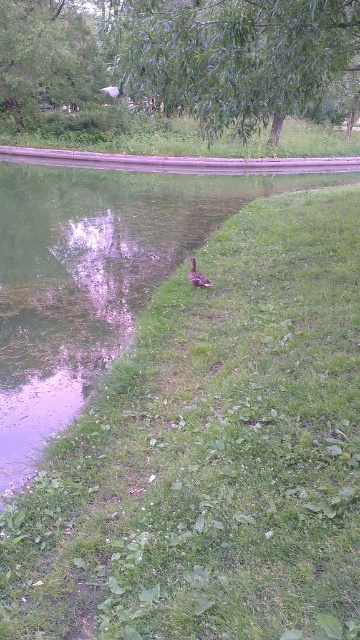
Can you confirm if green grass at center is shorter than green leafy tree at upper center?

Yes.

Who is more forward, (136, 428) or (198, 3)?

Point (136, 428)

Locate an element on the screen. green grass at center is located at coordinates (212, 452).

Can you confirm if green grass at center is positioned below green leafy tree at upper left?

Indeed, green grass at center is positioned under green leafy tree at upper left.

In the scene shown: Which is above, green grass at center or green leafy tree at upper left?

green leafy tree at upper left

Who is more forward, [253,371] or [11,96]?

Point [253,371] is in front.

In order to click on green grass at center in this screenshot , I will do `click(212, 452)`.

Who is more forward, (159, 470) or (200, 275)?

Point (159, 470) is in front.

Is point (251, 464) positioned before point (209, 285)?

Yes, it is.

Identify the location of green grass at center. The width and height of the screenshot is (360, 640). (212, 452).